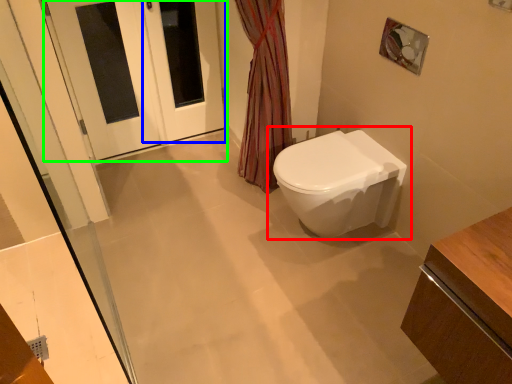
Question: Which object is the farthest from toilet (highlighted by a red box)? Choose among these: screen door (highlighted by a blue box) or door (highlighted by a green box).

Choices:
 (A) screen door
 (B) door

Answer: (B)